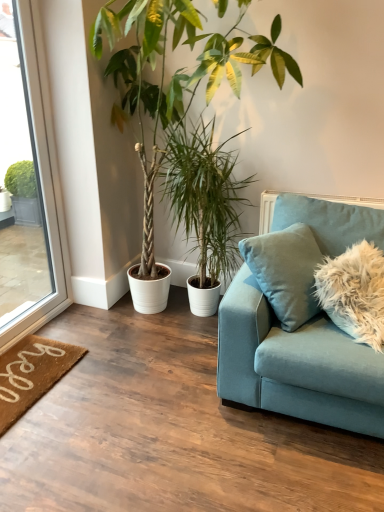
Question: Considering the relative positions of clear glass window at left and green leafy plant at center, the first houseplant positioned from the right, in the image provided, is clear glass window at left behind green leafy plant at center, the first houseplant positioned from the right,?

Choices:
 (A) no
 (B) yes

Answer: (A)

Question: Could you tell me if clear glass window at left is turned towards green leafy plant at center, placed as the 2th houseplant when sorted from left to right?

Choices:
 (A) no
 (B) yes

Answer: (B)

Question: Can green leafy plant at center, the first houseplant positioned from the right, be found inside clear glass window at left?

Choices:
 (A) no
 (B) yes

Answer: (A)

Question: Does clear glass window at left have a greater height compared to green leafy plant at center, placed as the 2th houseplant when sorted from left to right?

Choices:
 (A) no
 (B) yes

Answer: (B)

Question: Is clear glass window at left at the right side of green leafy plant at center, the first houseplant positioned from the right?

Choices:
 (A) no
 (B) yes

Answer: (A)

Question: Is clear glass window at left taller or shorter than brown coir doormat at lower left?

Choices:
 (A) tall
 (B) short

Answer: (A)

Question: Is clear glass window at left inside the boundaries of brown coir doormat at lower left, or outside?

Choices:
 (A) outside
 (B) inside

Answer: (A)

Question: From a real-world perspective, is clear glass window at left positioned above or below brown coir doormat at lower left?

Choices:
 (A) below
 (B) above

Answer: (B)

Question: Is point (56, 248) positioned closer to the camera than point (34, 377)?

Choices:
 (A) farther
 (B) closer

Answer: (A)

Question: Visually, is brown coir doormat at lower left positioned to the left or to the right of fluffy light brown pillow at right?

Choices:
 (A) left
 (B) right

Answer: (A)

Question: From the image's perspective, is brown coir doormat at lower left located above or below fluffy light brown pillow at right?

Choices:
 (A) above
 (B) below

Answer: (B)

Question: Considering their positions, is brown coir doormat at lower left located in front of or behind fluffy light brown pillow at right?

Choices:
 (A) front
 (B) behind

Answer: (B)

Question: Is brown coir doormat at lower left taller or shorter than fluffy light brown pillow at right?

Choices:
 (A) tall
 (B) short

Answer: (B)

Question: Based on their sizes in the image, would you say teal velvet couch at right is bigger or smaller than green leafy plant at center, the first houseplant positioned from the right?

Choices:
 (A) small
 (B) big

Answer: (B)

Question: Visually, is teal velvet couch at right positioned to the left or to the right of green leafy plant at center, placed as the 2th houseplant when sorted from left to right?

Choices:
 (A) left
 (B) right

Answer: (B)